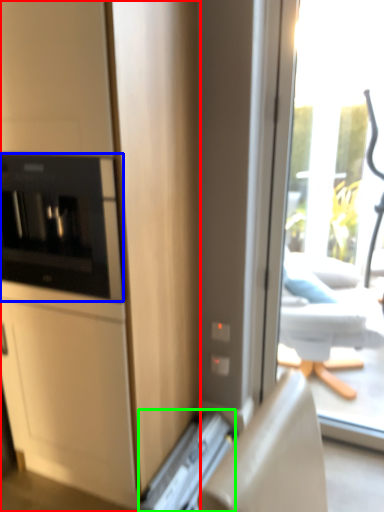
Question: Considering the real-world distances, which object is farthest from cabinetry (highlighted by a red box)? home appliance (highlighted by a blue box) or appliance (highlighted by a green box)?

Choices:
 (A) home appliance
 (B) appliance

Answer: (B)